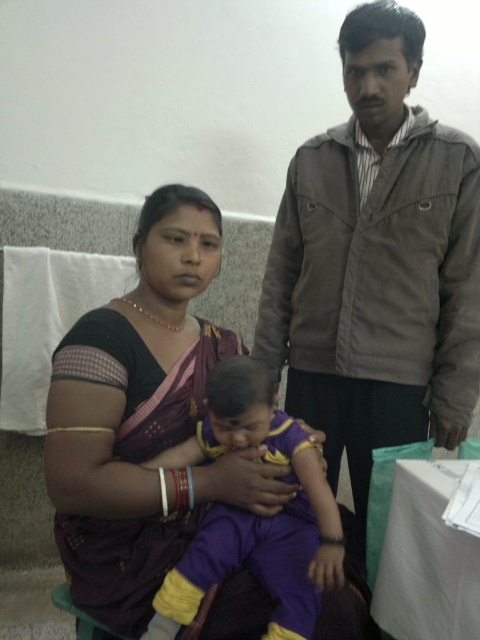
Who is shorter, gray corduroy jacket at center or purple silk saree at center?

Standing shorter between the two is purple silk saree at center.

Between gray corduroy jacket at center and purple silk saree at center, which one has more height?

gray corduroy jacket at center is taller.

Between point (453, 422) and point (197, 232), which one is positioned behind?

Positioned behind is point (453, 422).

Locate an element on the screen. This screenshot has height=640, width=480. gray corduroy jacket at center is located at coordinates (376, 262).

Which of these two, gray corduroy jacket at center or purple fabric baby at center, stands shorter?

purple fabric baby at center

Does gray corduroy jacket at center have a smaller size compared to purple fabric baby at center?

Actually, gray corduroy jacket at center might be larger than purple fabric baby at center.

Does point (441, 170) lie behind point (305, 522)?

Yes, point (441, 170) is farther from viewer.

The width and height of the screenshot is (480, 640). I want to click on gray corduroy jacket at center, so click(376, 262).

Which of these two, purple silk saree at center or purple fabric baby at center, stands shorter?

Standing shorter between the two is purple fabric baby at center.

Who is lower down, purple silk saree at center or purple fabric baby at center?

purple fabric baby at center is below.

You are a GUI agent. You are given a task and a screenshot of the screen. Output one action in this format:
    pyautogui.click(x=<x>, y=<y>)
    Task: Click on the purple silk saree at center
    
    Given the screenshot: What is the action you would take?
    pyautogui.click(x=142, y=419)